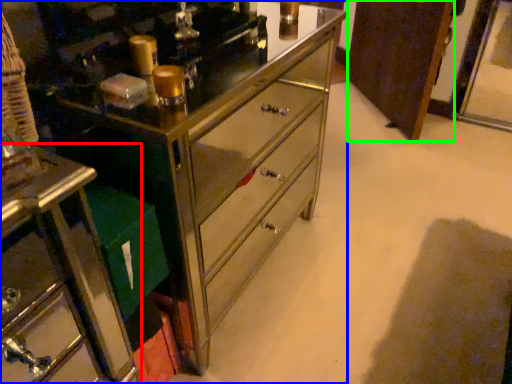
Question: Which object is positioned closest to furniture (highlighted by a red box)? Select from chest of drawers (highlighted by a blue box) and cabinetry (highlighted by a green box).

Choices:
 (A) chest of drawers
 (B) cabinetry

Answer: (A)